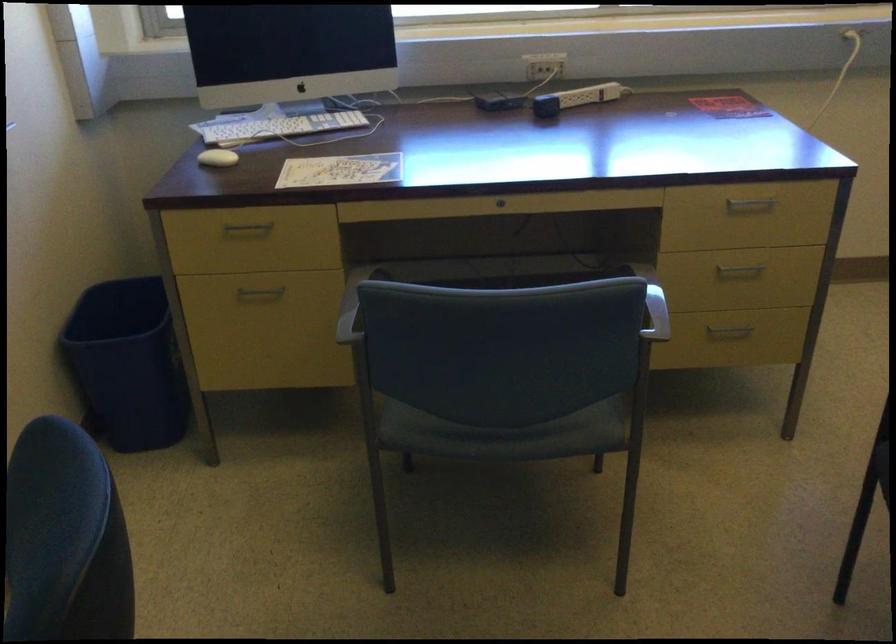
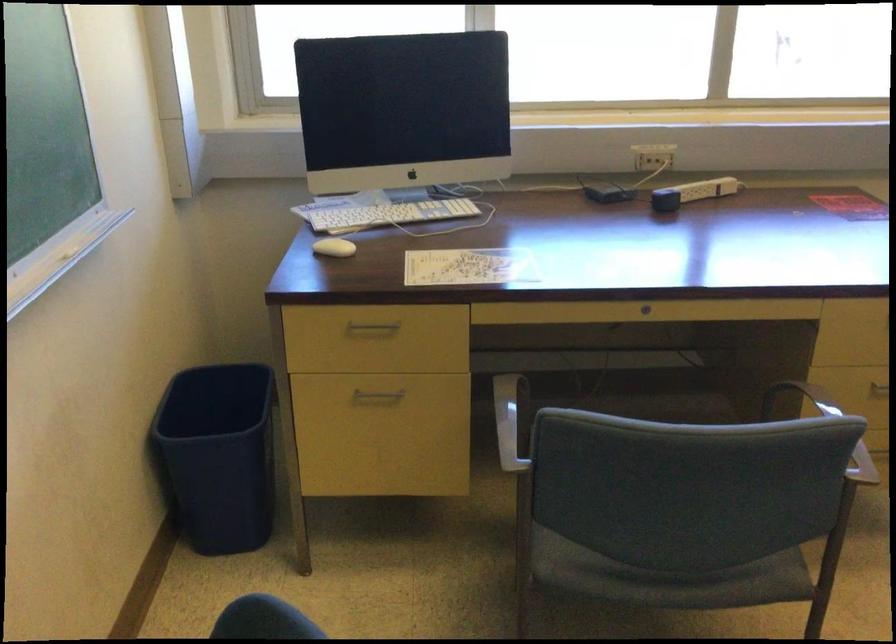
The point at (282,129) is marked in the first image. Where is the corresponding point in the second image?

(389, 214)